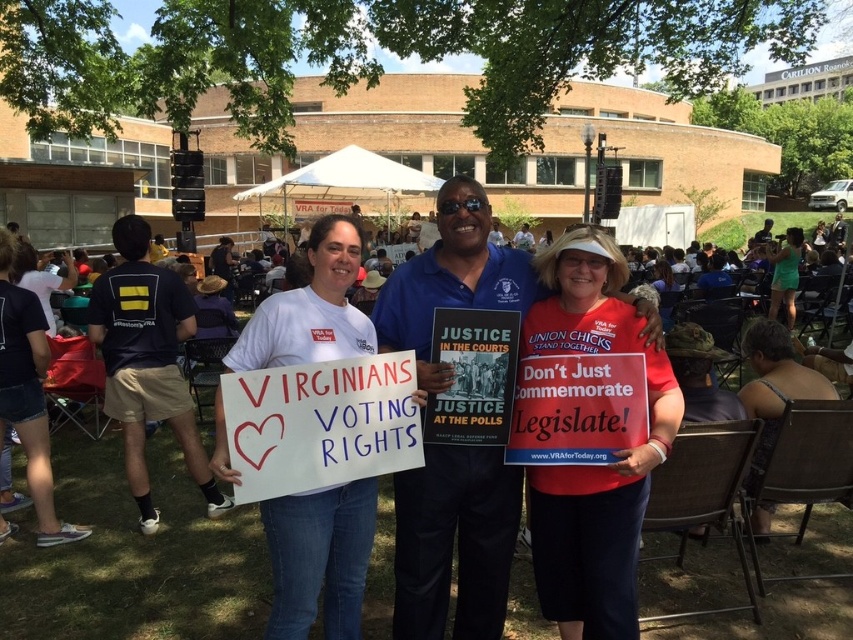
You are a photographer at the protest trying to capture both the red matte sign at center and the white paper sign at center in a single shot. Can you position yourself so that both signs are visible without one blocking the other?

The red matte sign at center is positioned under the white paper sign at center, so if you position yourself so that the camera is above the red matte sign at center, you can see both signs without obstruction.

You are a photographer trying to capture both the red matte sign at center and the white paper sign at center in a single frame. Based on their sizes, which sign will appear larger in your photo?

The red matte sign at center will appear larger in the photo because it has a greater height compared to the white paper sign at center.

You are taking a photo of the protest scene and want to focus on both the point at (682, 406) and the point at (355, 512). Which point should you adjust your focus to first to ensure both are in clear view?

You should focus on point (682, 406) first because it is closer to the camera than point (355, 512). By focusing on the closer point, the farther point may still be within the depth of field, ensuring both are in clear view.